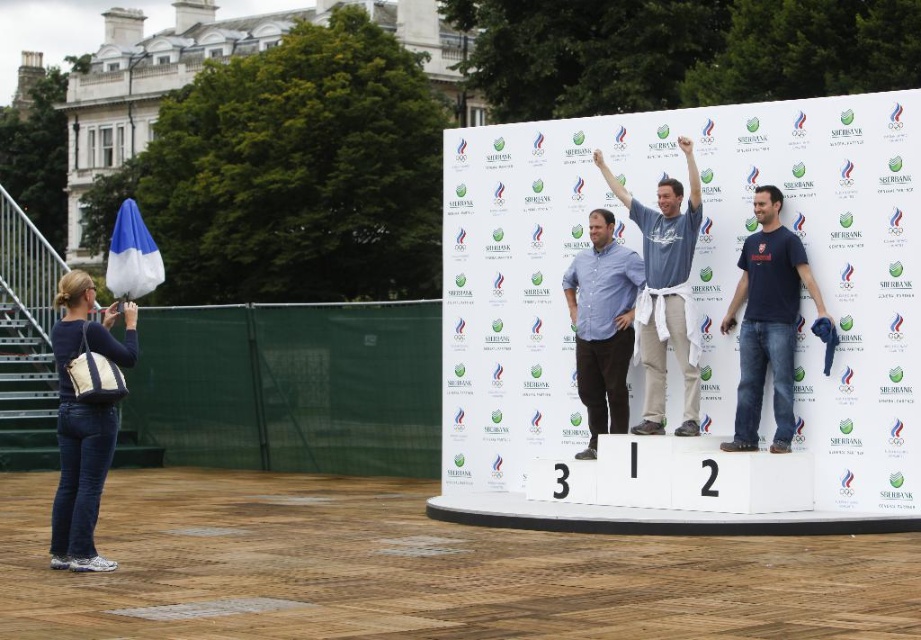
Is the position of dark blue t-shirt at center more distant than that of light blue fabric shirt at center?

No, dark blue t-shirt at center is in front of light blue fabric shirt at center.

Is dark blue t-shirt at center to the left of light blue fabric shirt at center from the viewer's perspective?

Incorrect, dark blue t-shirt at center is not on the left side of light blue fabric shirt at center.

Identify the location of dark blue t-shirt at center. The image size is (921, 640). (768, 321).

Find the location of a particular element. The height and width of the screenshot is (640, 921). dark blue t-shirt at center is located at coordinates (768, 321).

Consider the image. Can you confirm if dark blue denim jeans at lower left is positioned below matte blue shirt at center?

Yes, dark blue denim jeans at lower left is below matte blue shirt at center.

Does dark blue denim jeans at lower left have a smaller size compared to matte blue shirt at center?

No, dark blue denim jeans at lower left is not smaller than matte blue shirt at center.

Is point (123, 314) positioned in front of point (628, 320)?

That is True.

Where is `dark blue denim jeans at lower left`? This screenshot has height=640, width=921. dark blue denim jeans at lower left is located at coordinates (84, 420).

Between point (60, 320) and point (651, 211), which one is positioned in front?

Point (651, 211) is more forward.

Who is higher up, dark blue denim jeans at lower left or light blue fabric shirt at center?

light blue fabric shirt at center

Who is more distant from viewer, (90, 332) or (612, 188)?

Point (612, 188)

This screenshot has height=640, width=921. Identify the location of dark blue denim jeans at lower left. (84, 420).